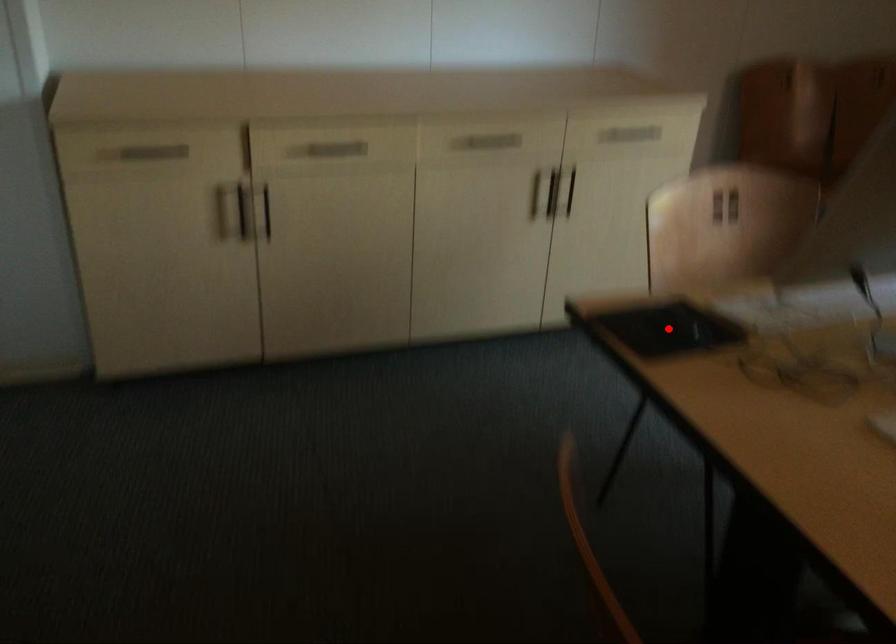
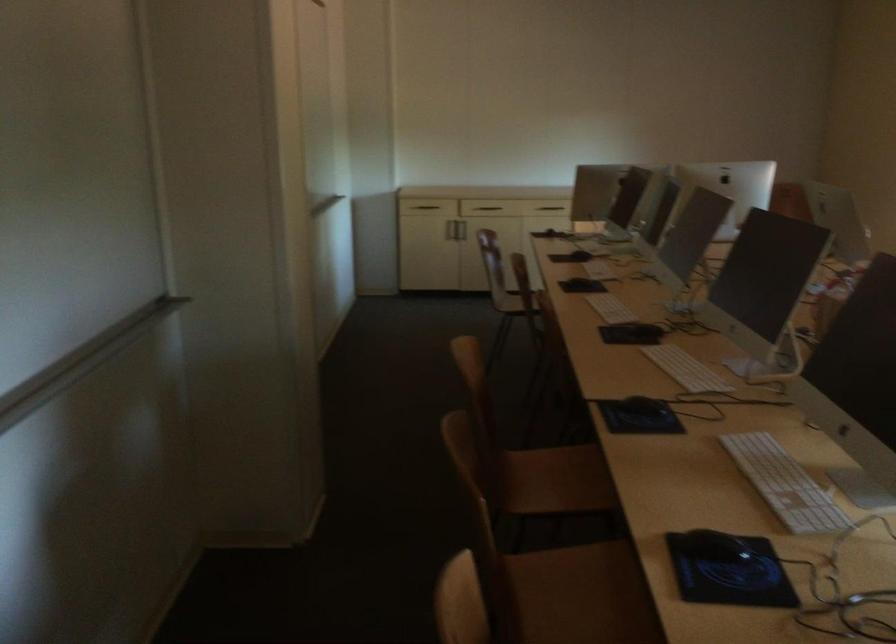
Question: I am providing you with two images of the same scene from different viewpoints. A red point is marked on the first image. Can you still see the location of the red point in image 2?

Choices:
 (A) Yes
 (B) No

Answer: (B)